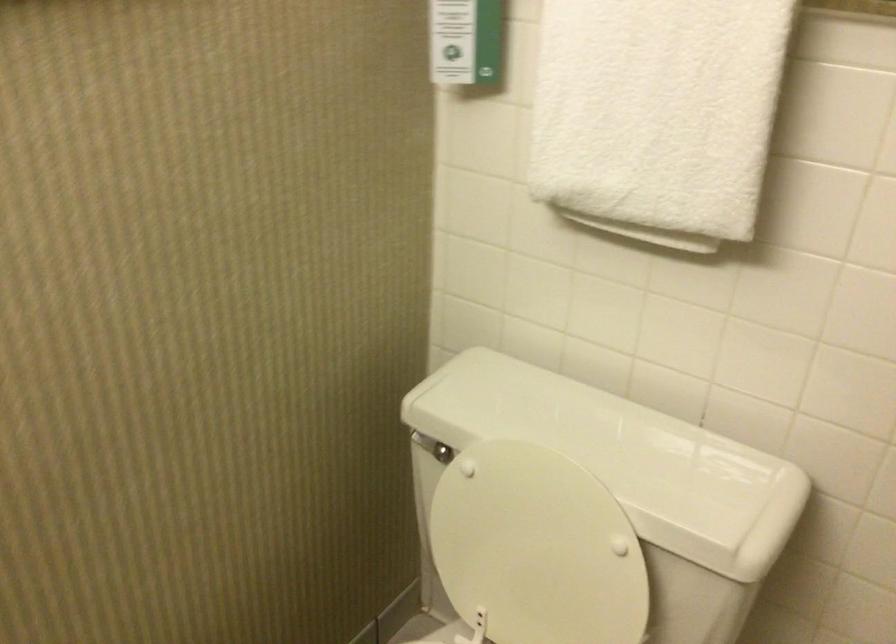
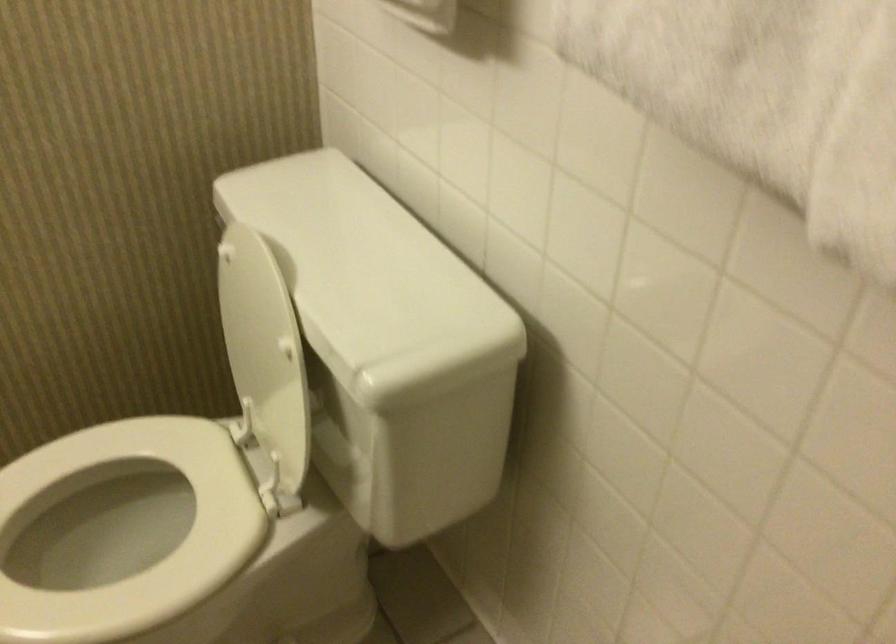
Question: Based on the continuous images, in which direction is the camera rotating? Reply with the corresponding letter.

Choices:
 (A) Left
 (B) Right
 (C) Up
 (D) Down

Answer: (A)